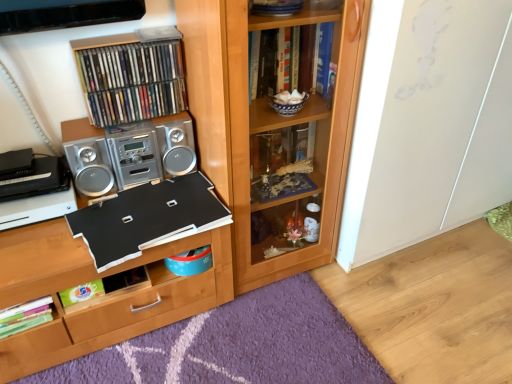
Question: In terms of size, does purple shaggy rug at lower center appear bigger or smaller than black matte board at center, which is counted as the 1th book, starting from the bottom?

Choices:
 (A) big
 (B) small

Answer: (A)

Question: From the image's perspective, is purple shaggy rug at lower center above or below black matte board at center, which is the third book in top-to-bottom order?

Choices:
 (A) below
 (B) above

Answer: (A)

Question: Which object is the farthest from the silver metallic stereo at center?

Choices:
 (A) wooden bookcase at center
 (B) black matte board at center, which is the third book in top-to-bottom order
 (C) transparent glass cabinet at center
 (D) metallic silver stereo at upper left, which appears as the 2th book when ordered from the bottom
 (E) metallic cd case at upper left, which appears as the 3th book when ordered from the bottom

Answer: (C)

Question: Which object is the farthest from the metallic silver stereo at upper left, the second book viewed from the top?

Choices:
 (A) silver metallic stereo at center
 (B) purple shaggy rug at lower center
 (C) wooden bookcase at center
 (D) transparent glass cabinet at center
 (E) black matte board at center, which is counted as the 1th book, starting from the bottom

Answer: (D)